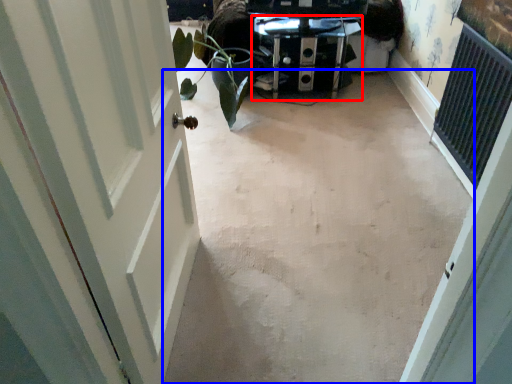
Question: Among these objects, which one is nearest to the camera, furniture (highlighted by a red box) or concrete (highlighted by a blue box)?

Choices:
 (A) furniture
 (B) concrete

Answer: (B)